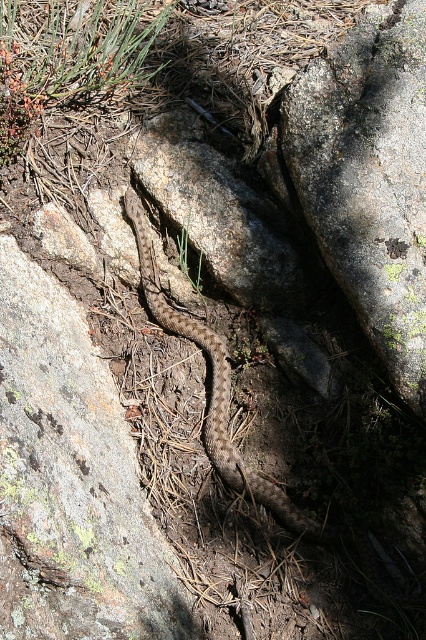
Question: Is speckled gray rock at center to the right of brown/scaly snake at center from the viewer's perspective?

Choices:
 (A) yes
 (B) no

Answer: (A)

Question: Can you confirm if speckled rock at center is smaller than speckled gray rock at center?

Choices:
 (A) no
 (B) yes

Answer: (A)

Question: Does speckled rock at center have a smaller size compared to brown/scaly snake at center?

Choices:
 (A) no
 (B) yes

Answer: (A)

Question: Which object is farther from the camera taking this photo?

Choices:
 (A) speckled rock at center
 (B) brown/scaly snake at center

Answer: (B)

Question: Which point is closer to the camera?

Choices:
 (A) (62, 436)
 (B) (241, 476)
 (C) (377, 188)

Answer: (A)

Question: Which point is closer to the camera taking this photo?

Choices:
 (A) (238, 456)
 (B) (411, 336)

Answer: (B)